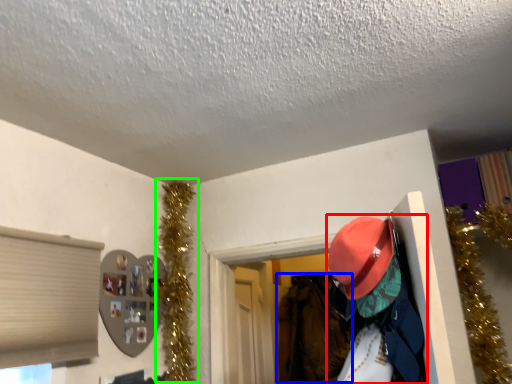
Question: Estimate the real-world distances between objects in this image. Which object is closer to person (highlighted by a red box), clothing (highlighted by a blue box) or christmas decoration (highlighted by a green box)?

Choices:
 (A) clothing
 (B) christmas decoration

Answer: (B)